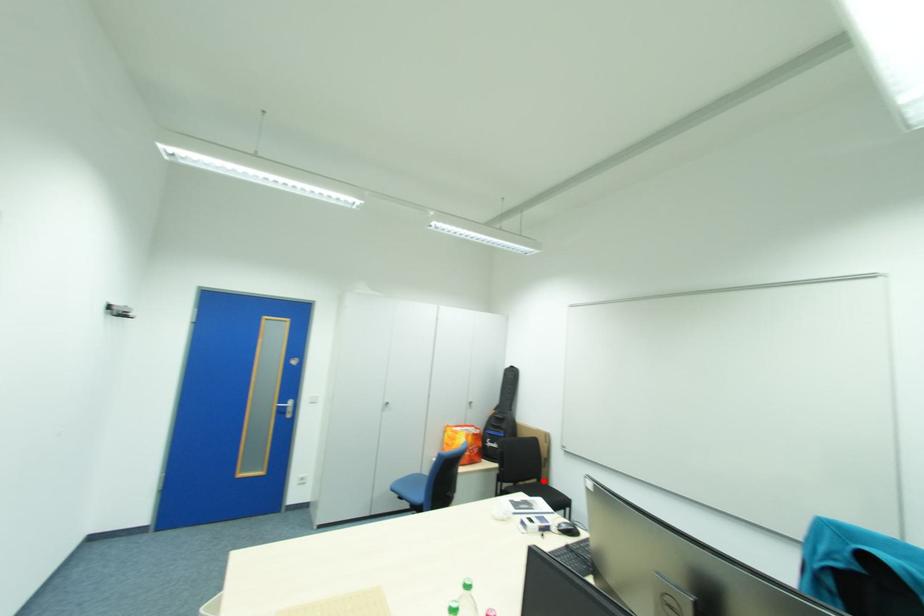
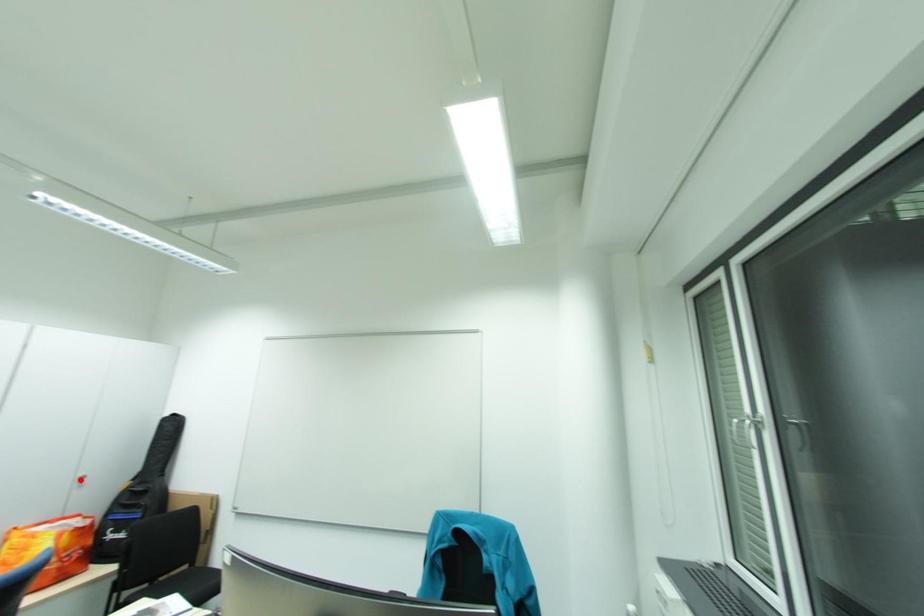
I am providing you with two images of the same scene from different viewpoints. A red point is marked on the first image and another point is marked on the second image. Are the points marked in image1 and image2 representing the same 3D position?

No